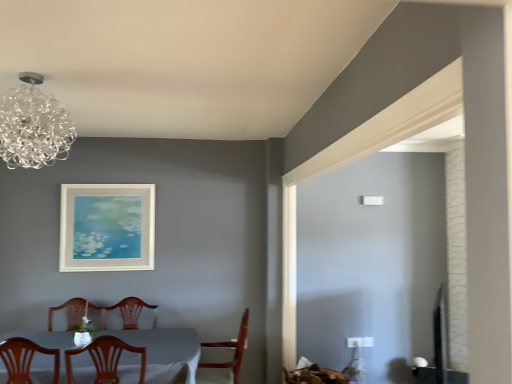
Question: Is white glossy table at lower left at the back of wooden chair at center, the 1th chair when ordered from left to right?

Choices:
 (A) no
 (B) yes

Answer: (B)

Question: Does wooden chair at center, the second chair viewed from the back, have a larger size compared to white glossy table at lower left?

Choices:
 (A) no
 (B) yes

Answer: (A)

Question: Can you confirm if wooden chair at center, the second chair viewed from the back, is thinner than white glossy table at lower left?

Choices:
 (A) no
 (B) yes

Answer: (B)

Question: From the image's perspective, does wooden chair at center, the 1th chair when ordered from left to right, appear lower than white glossy table at lower left?

Choices:
 (A) no
 (B) yes

Answer: (A)

Question: Is wooden chair at center, the second chair viewed from the back, next to white glossy table at lower left?

Choices:
 (A) yes
 (B) no

Answer: (B)

Question: From a real-world perspective, relative to white glossy table at lower left, is transparent glass chandelier at upper left vertically above or below?

Choices:
 (A) above
 (B) below

Answer: (A)

Question: In terms of height, does transparent glass chandelier at upper left look taller or shorter compared to white glossy table at lower left?

Choices:
 (A) short
 (B) tall

Answer: (A)

Question: Would you say transparent glass chandelier at upper left is inside or outside white glossy table at lower left?

Choices:
 (A) outside
 (B) inside

Answer: (A)

Question: From the image's perspective, is transparent glass chandelier at upper left positioned above or below white glossy table at lower left?

Choices:
 (A) above
 (B) below

Answer: (A)

Question: Is transparent glass chandelier at upper left wider or thinner than white matte picture frame at upper center?

Choices:
 (A) wide
 (B) thin

Answer: (A)

Question: From the image's perspective, is transparent glass chandelier at upper left above or below white matte picture frame at upper center?

Choices:
 (A) above
 (B) below

Answer: (A)

Question: Does point (7, 134) appear closer or farther from the camera than point (137, 266)?

Choices:
 (A) closer
 (B) farther

Answer: (A)

Question: Relative to white matte picture frame at upper center, is transparent glass chandelier at upper left in front or behind?

Choices:
 (A) front
 (B) behind

Answer: (A)

Question: Does point [x=109, y=347] appear closer or farther from the camera than point [x=88, y=352]?

Choices:
 (A) farther
 (B) closer

Answer: (B)

Question: From a real-world perspective, is wooden chair at center, the second chair viewed from the back, physically located above or below white glossy table at lower left?

Choices:
 (A) below
 (B) above

Answer: (B)